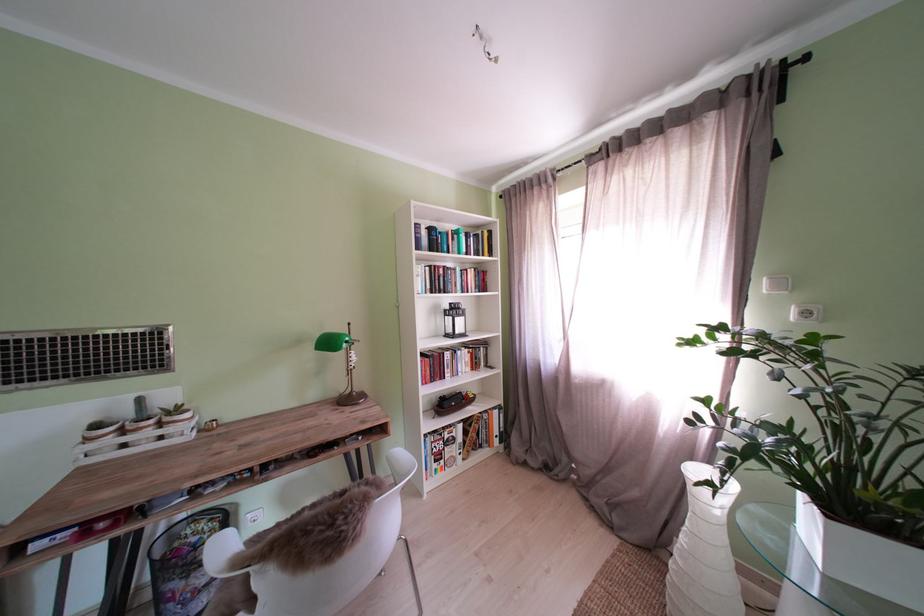
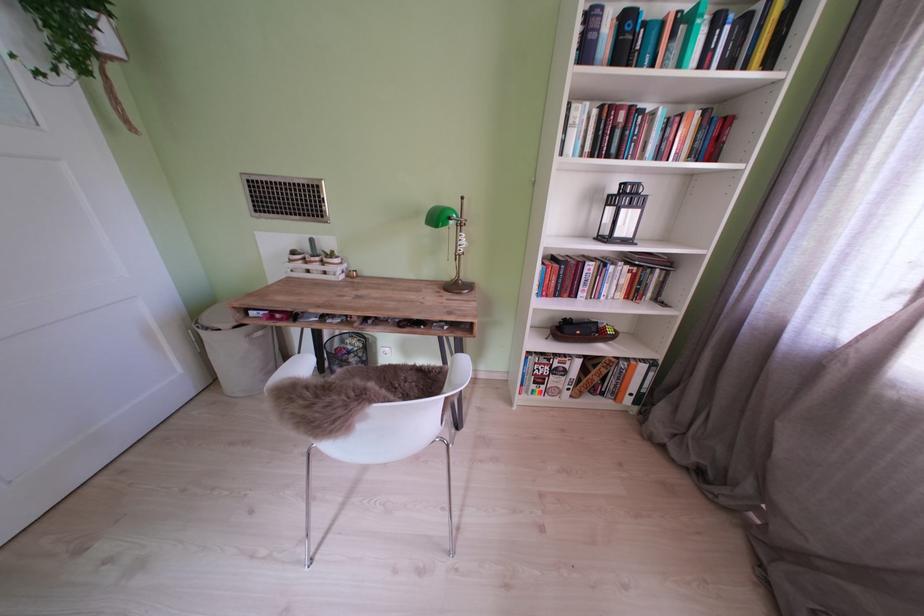
The first image is from the beginning of the video and the second image is from the end. How did the camera likely rotate when shooting the video?

The camera rotated toward left-down.